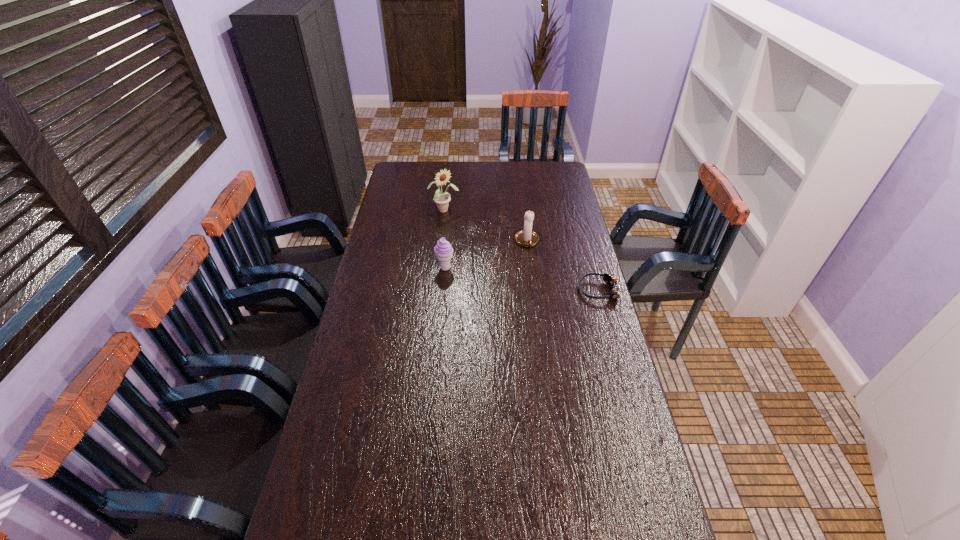
Find the location of a particular element. The image size is (960, 540). vacant space on the desktop that is between the third farthest object and the nearest object and is positioned on the handle side of the candle holder is located at coordinates (540, 282).

Find the location of a particular element. The height and width of the screenshot is (540, 960). vacant space on the desktop that is between the icecream and the nearest object and is positioned on the front-facing side of the farthest object is located at coordinates (517, 279).